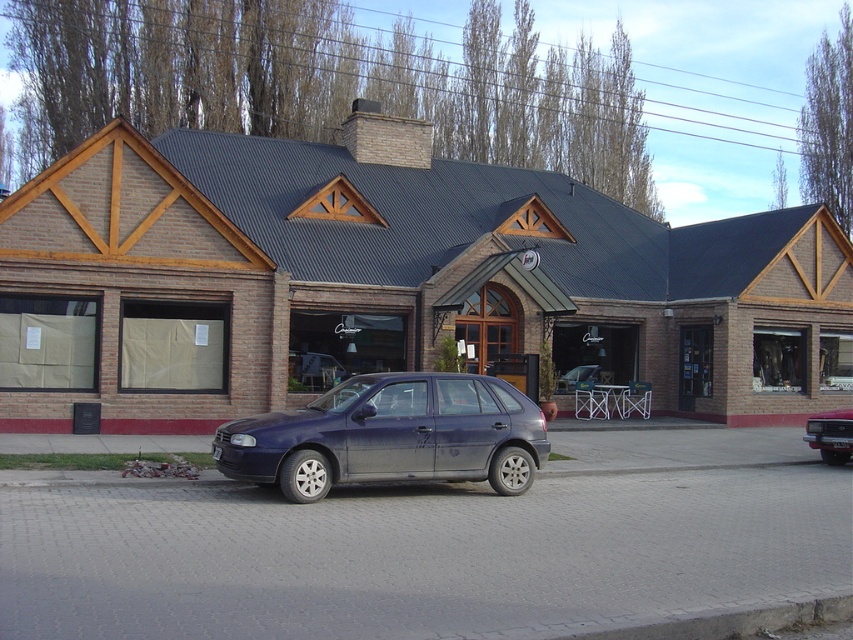
You are a delivery driver who needs to park your metallic silver car at center as close as possible to the brick building at center. According to the scene, what is the minimum distance you can achieve between your car and the brick building?

The brick building at center is 38.31 feet from metallic silver car at center, so the minimum distance you can achieve between your car and the brick building is 38.31 feet.